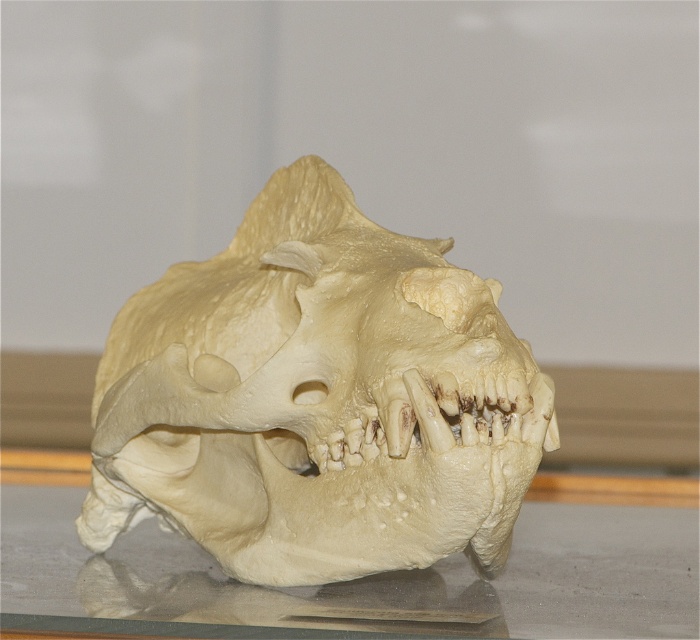
You are a museum curator arranging an exhibit. You have a white matte skull at center and a translucent glass table at lower center. Which object is taller?

The white matte skull at center is much taller than the translucent glass table at lower center according to the description.

What object is located at the coordinates point (316, 400) in the image?

The white matte skull at center is located at point (316, 400).

You are examining the large animal skull in the image. There are two points marked on it, one at coordinates point (x=197, y=492) and the other at point (x=595, y=570). Which of these points is nearer to your viewpoint as you look at the skull?

Point (x=197, y=492) is closer to the camera than point (x=595, y=570), so the point at coordinates point (x=197, y=492) is nearer to your viewpoint.